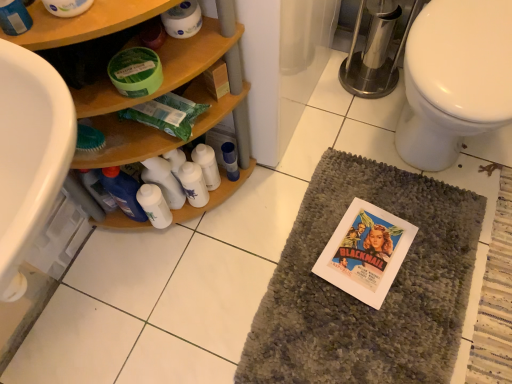
Image resolution: width=512 pixels, height=384 pixels. Identify the location of vacant space to the left of white paper comic book at center. (302, 271).